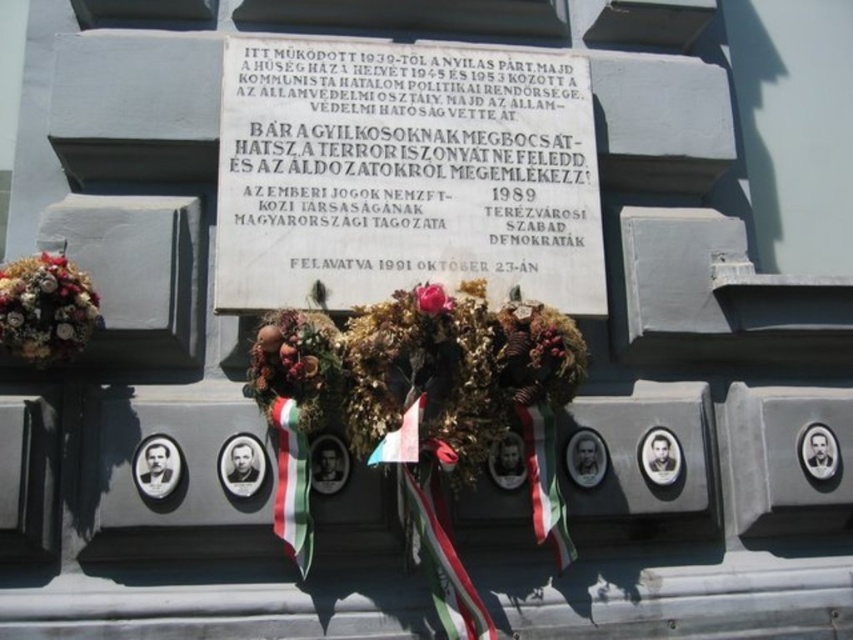
You are a historian examining the memorial. You notice the white marble plaque at center and the green and white striped ribbon at center. Which object is closer to you?

The white marble plaque at center is closer to you than the green and white striped ribbon at center.

You are a photographer standing in front of the memorial plaque. You want to capture a photo of the dried floral bouquet at center without any obstructions. Is the bouquet within your camera lens range if your camera can focus as close as 2.5 meters?

The dried floral bouquet at center is 3.00 meters from camera, which is beyond the camera lens range since it can only focus as close as 2.5 meters. You need to move closer or use a different lens.